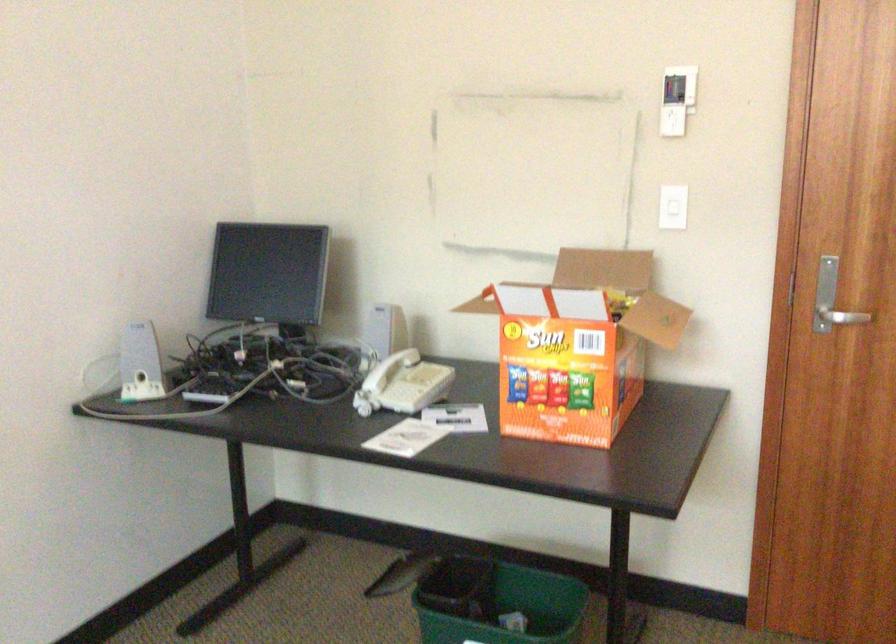
The location [578,345] corresponds to which object?

It corresponds to the orange cardboard box in the image.